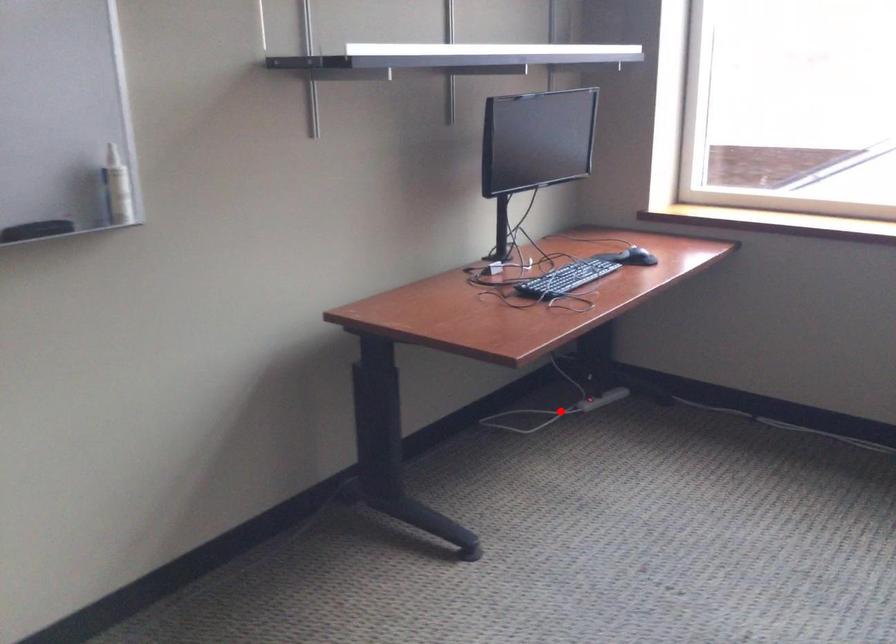
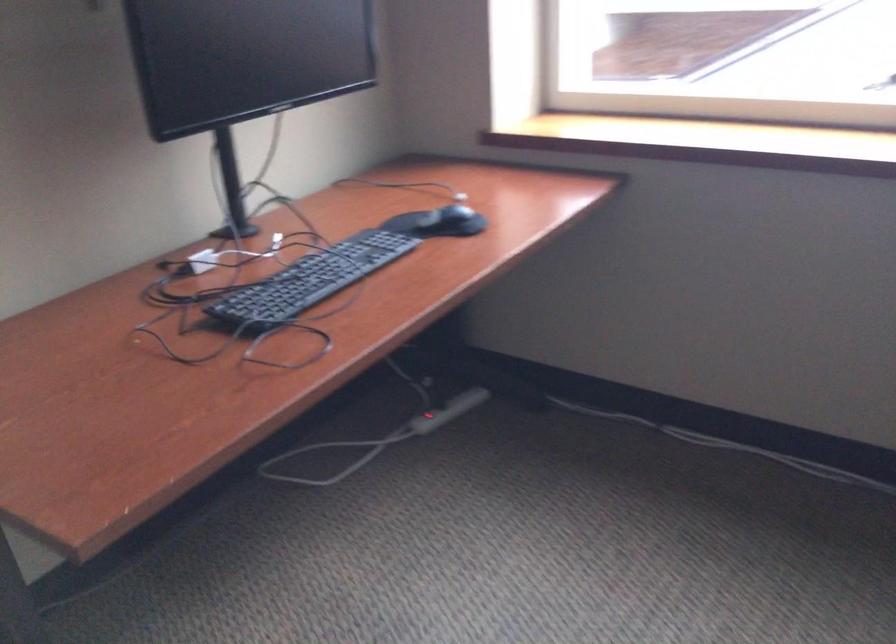
Locate, in the second image, the point that corresponds to the highlighted location in the first image.

(378, 439)